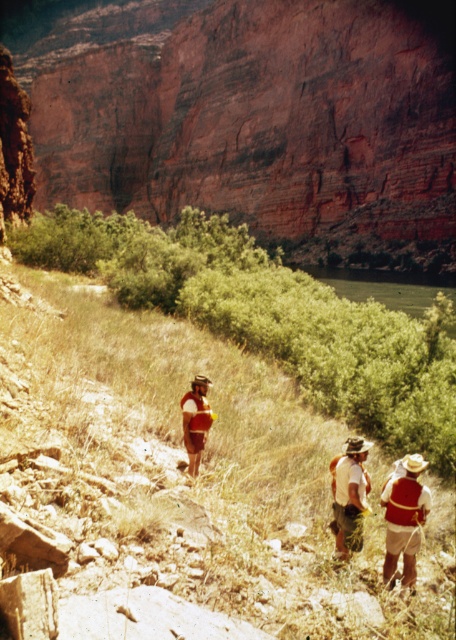
Is matte red vest at center closer to camera compared to white fabric shirt at lower center?

Yes, matte red vest at center is closer to the viewer.

This screenshot has width=456, height=640. What do you see at coordinates (404, 518) in the screenshot?
I see `matte red vest at center` at bounding box center [404, 518].

Between point (405, 509) and point (359, 500), which one is positioned in front?

Point (405, 509) is more forward.

This screenshot has height=640, width=456. I want to click on matte red vest at center, so click(404, 518).

Consider the image. Does matte red vest at center have a larger size compared to matte red backpack at center?

No, matte red vest at center is not bigger than matte red backpack at center.

Does matte red vest at center appear over matte red backpack at center?

No.

Between point (407, 456) and point (191, 400), which one is positioned in front?

Point (191, 400) is in front.

Where is `matte red vest at center`? This screenshot has height=640, width=456. matte red vest at center is located at coordinates tap(404, 518).

Is white fabric shirt at lower center thinner than matte red backpack at center?

Indeed, white fabric shirt at lower center has a lesser width compared to matte red backpack at center.

Does white fabric shirt at lower center have a greater height compared to matte red backpack at center?

Yes, white fabric shirt at lower center is taller than matte red backpack at center.

Who is more forward, (347, 468) or (196, 461)?

Point (347, 468)

This screenshot has width=456, height=640. Identify the location of white fabric shirt at lower center. (350, 493).